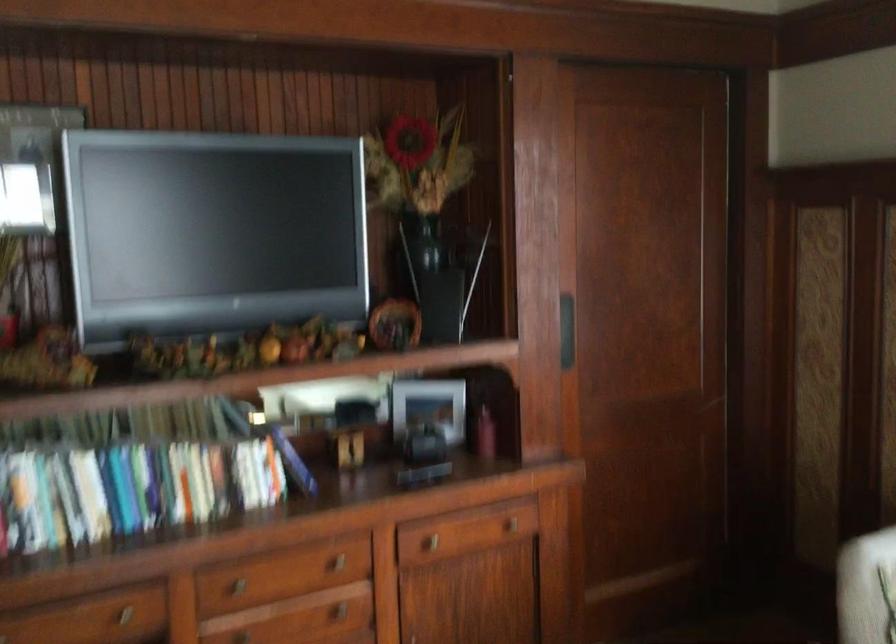
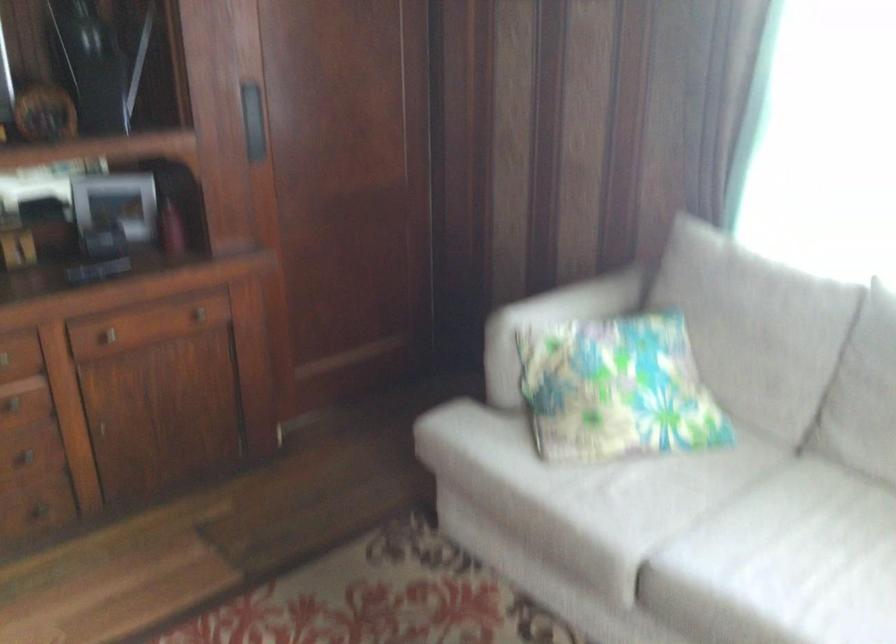
Question: Which direction would the cameraman need to move to produce the second image? Reply with the corresponding letter.

Choices:
 (A) Left
 (B) Right
 (C) Forward
 (D) Backward

Answer: (B)